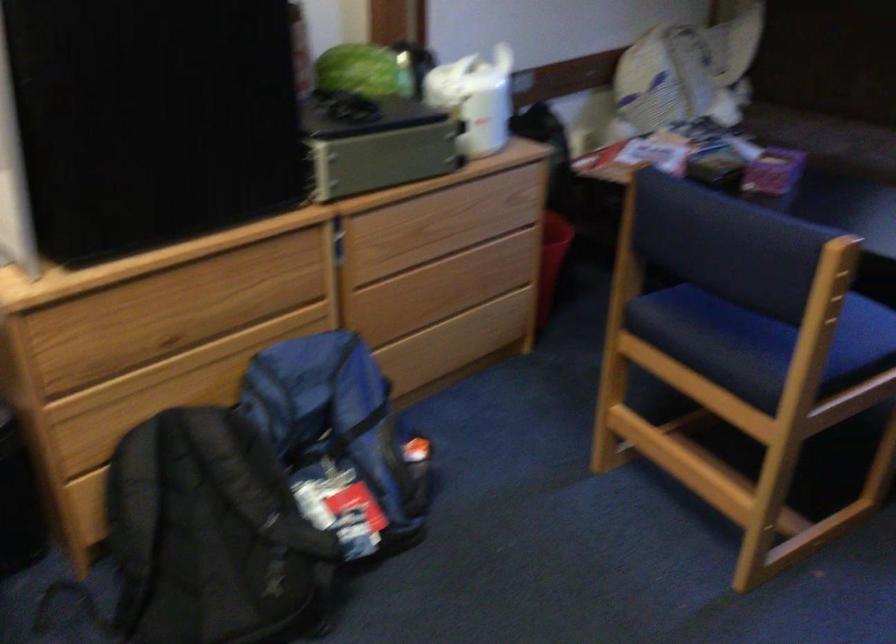
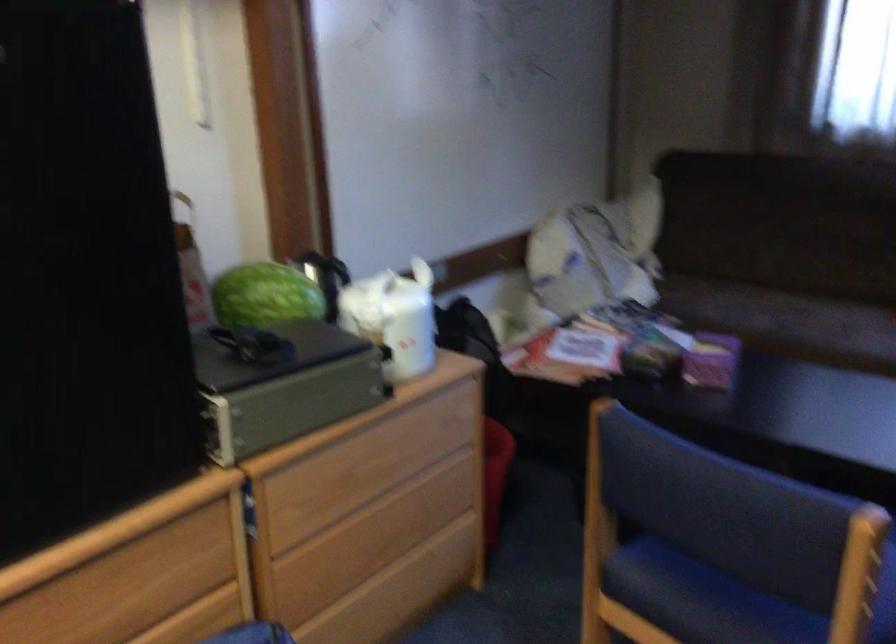
Locate, in the second image, the point that corresponds to point 703,330 in the first image.

(702, 599)